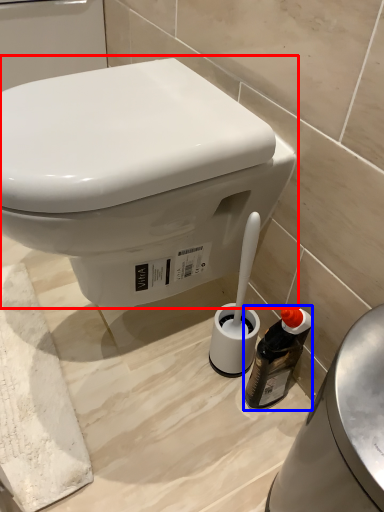
Question: Which object appears farthest to the camera in this image, toilet (highlighted by a red box) or bottle (highlighted by a blue box)?

Choices:
 (A) toilet
 (B) bottle

Answer: (B)